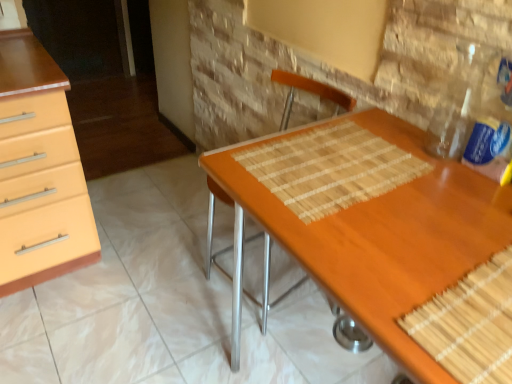
This screenshot has height=384, width=512. What are the coordinates of `free location to the right of bamboo placemat at center` in the screenshot? It's located at (440, 180).